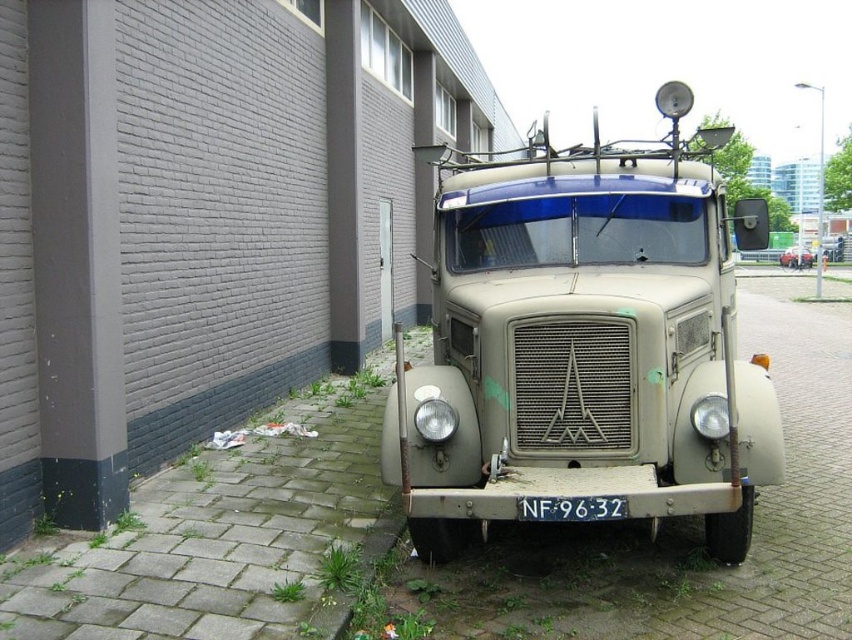
Measure the distance between point (557, 369) and camera.

Point (557, 369) is 3.88 meters away from camera.

Is point (676, 509) less distant than point (540, 515)?

No, it is behind (540, 515).

Locate an element on the screen. The width and height of the screenshot is (852, 640). matte beige truck at center is located at coordinates (586, 342).

This screenshot has width=852, height=640. I want to click on matte beige truck at center, so click(x=586, y=342).